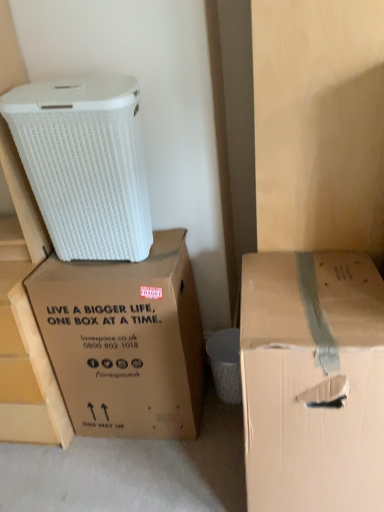
Question: From a real-world perspective, is brown cardboard box at center, the 2th box viewed from the right, physically above brown cardboard box at right, positioned as the first box in right-to-left order?

Choices:
 (A) yes
 (B) no

Answer: (A)

Question: From the image's perspective, does brown cardboard box at center, the 2th box viewed from the right, appear higher than brown cardboard box at right, the second box positioned from the left?

Choices:
 (A) no
 (B) yes

Answer: (B)

Question: Is brown cardboard box at center, the 2th box viewed from the right, facing towards brown cardboard box at right, the second box positioned from the left?

Choices:
 (A) yes
 (B) no

Answer: (B)

Question: Is brown cardboard box at right, the second box positioned from the left, located within brown cardboard box at center, the 1th box positioned from the left?

Choices:
 (A) no
 (B) yes

Answer: (A)

Question: Is brown cardboard box at center, the 2th box viewed from the right, smaller than brown cardboard box at right, positioned as the first box in right-to-left order?

Choices:
 (A) no
 (B) yes

Answer: (B)

Question: Is brown cardboard box at center, the 2th box viewed from the right, not near brown cardboard box at right, positioned as the first box in right-to-left order?

Choices:
 (A) no
 (B) yes

Answer: (A)

Question: From a real-world perspective, is white matte cardboard box at upper left physically below brown cardboard box at center, the 2th box viewed from the right?

Choices:
 (A) no
 (B) yes

Answer: (A)

Question: From the image's perspective, is white matte cardboard box at upper left below brown cardboard box at center, the 2th box viewed from the right?

Choices:
 (A) no
 (B) yes

Answer: (A)

Question: Does white matte cardboard box at upper left appear on the right side of brown cardboard box at center, the 1th box positioned from the left?

Choices:
 (A) no
 (B) yes

Answer: (A)

Question: Is white matte cardboard box at upper left outside brown cardboard box at center, the 2th box viewed from the right?

Choices:
 (A) no
 (B) yes

Answer: (B)

Question: Is white matte cardboard box at upper left oriented towards brown cardboard box at center, the 1th box positioned from the left?

Choices:
 (A) yes
 (B) no

Answer: (B)

Question: From the image's perspective, would you say white matte cardboard box at upper left is positioned over brown cardboard box at center, the 2th box viewed from the right?

Choices:
 (A) no
 (B) yes

Answer: (B)

Question: Is white matte cardboard box at upper left oriented away from brown cardboard box at right, positioned as the first box in right-to-left order?

Choices:
 (A) no
 (B) yes

Answer: (A)